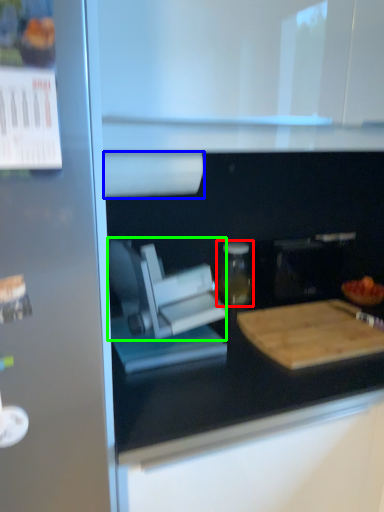
Question: Which object is positioned farthest from bottle (highlighted by a red box)? Select from paper towel (highlighted by a blue box) and appliance (highlighted by a green box).

Choices:
 (A) paper towel
 (B) appliance

Answer: (A)